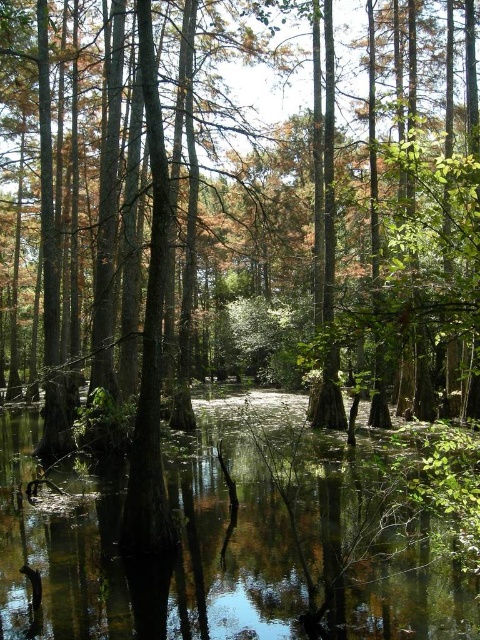
Based on the scene description, where is the green matte tree at center located in terms of coordinates?

The green matte tree at center is located at point coordinates of (264, 216).

You are a hiker who wants to cross the swamp. You see the green matte tree at center and the green reflective water at center. How far apart are these two landmarks?

The green matte tree at center and the green reflective water at center are 11.10 meters apart.